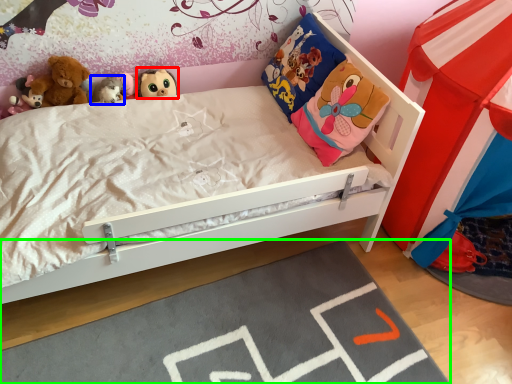
Question: Which is nearer to the toy (highlighted by a red box)? toy (highlighted by a blue box) or plain (highlighted by a green box).

Choices:
 (A) toy
 (B) plain

Answer: (A)